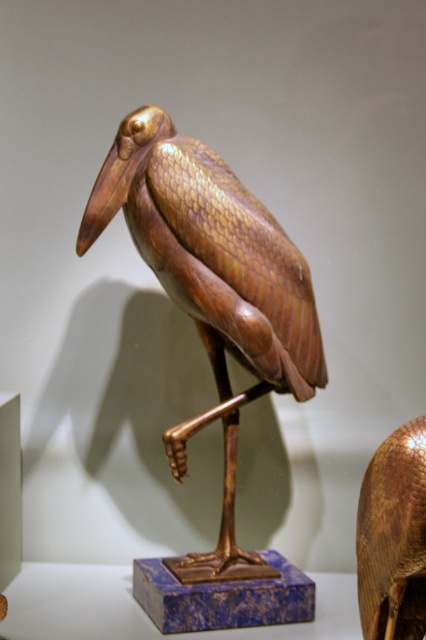
You are an art curator examining two sculptures in the same room. You notice the shiny gold bird at center and the gold textured bird at center. Which sculpture has a greater height?

The shiny gold bird at center is taller than the gold textured bird at center.

You are an art curator examining two sculptures in the same room. You notice the shiny gold bird at center and the gold textured bird at center. Which sculpture takes up more space in the room?

The shiny gold bird at center takes up more space in the room because it is bigger than the gold textured bird at center.